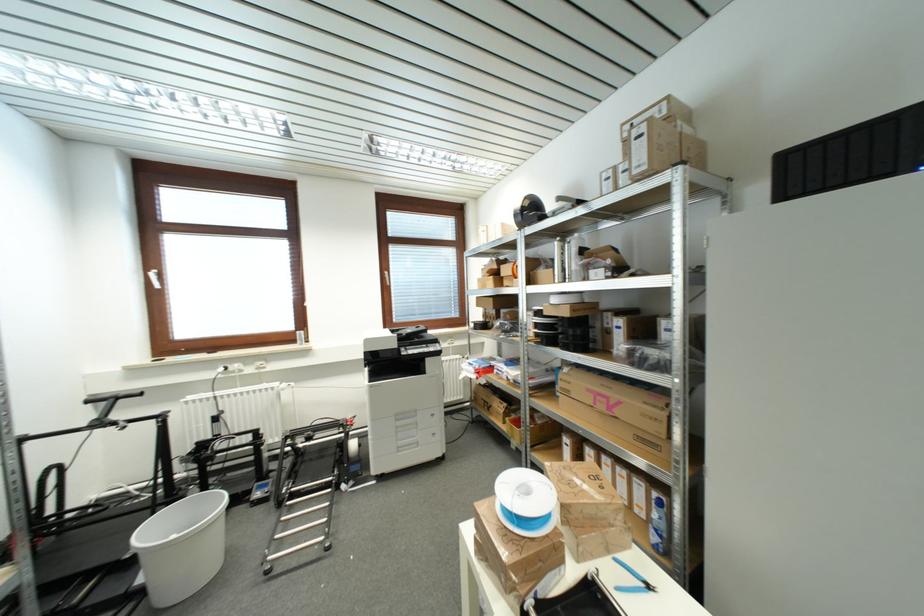
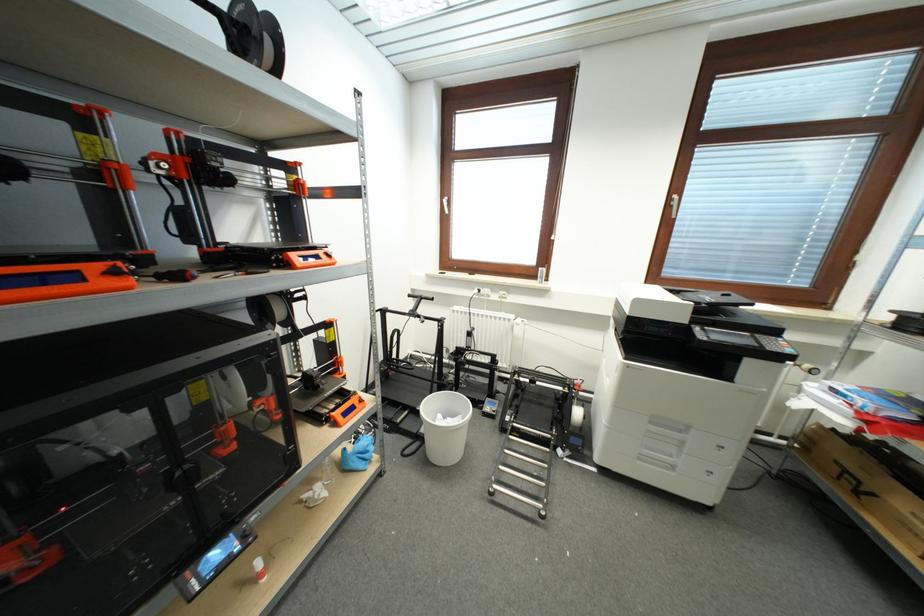
The point at (144, 582) is marked in the first image. Where is the corresponding point in the second image?

(427, 434)